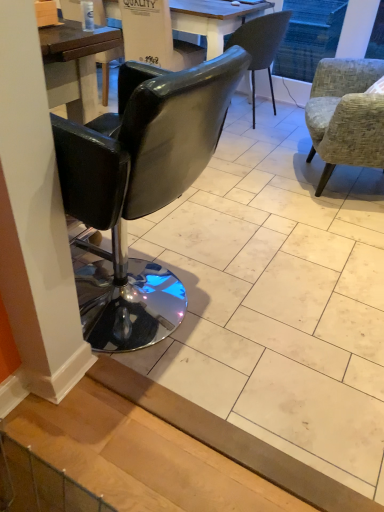
You are a GUI agent. You are given a task and a screenshot of the screen. Output one action in this format:
    pyautogui.click(x=<x>, y=<y>)
    Task: Click on the unoccupied region to the right of black leather chair at left, which ranks as the 3th chair in right-to-left order
    The height and width of the screenshot is (512, 384).
    Given the screenshot: What is the action you would take?
    pyautogui.click(x=263, y=320)